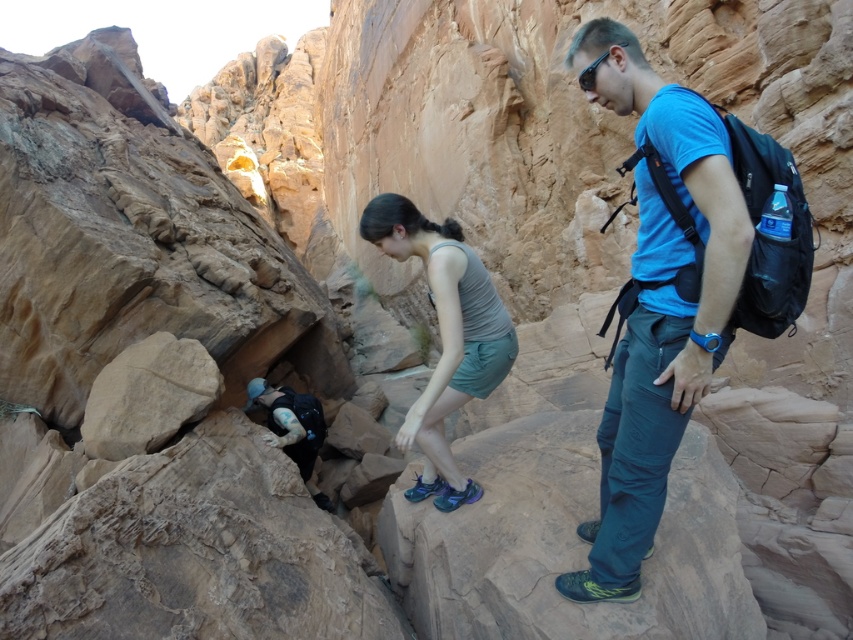
Which is more to the left, blue fabric shirt at upper right or gray fabric tank top at center?

Positioned to the left is gray fabric tank top at center.

The height and width of the screenshot is (640, 853). Describe the element at coordinates (657, 305) in the screenshot. I see `blue fabric shirt at upper right` at that location.

Is point (596, 588) positioned behind point (445, 296)?

No, (596, 588) is closer to viewer.

You are a GUI agent. You are given a task and a screenshot of the screen. Output one action in this format:
    pyautogui.click(x=<x>, y=<y>)
    Task: Click on the blue fabric shirt at upper right
    
    Given the screenshot: What is the action you would take?
    pyautogui.click(x=657, y=305)

Is point (630, 65) behind point (677, 177)?

Yes, it is behind point (677, 177).

I want to click on blue fabric shirt at upper right, so click(657, 305).

Who is more distant from viewer, (608, 467) or (654, 440)?

The point (608, 467) is more distant.

Find the location of a particular element. This screenshot has width=853, height=640. blue fabric shirt at upper right is located at coordinates (657, 305).

Based on the photo, which is below, gray fabric tank top at center or black plastic sunglasses at upper right?

Positioned lower is gray fabric tank top at center.

Does gray fabric tank top at center appear under black plastic sunglasses at upper right?

Yes.

I want to click on gray fabric tank top at center, so click(x=445, y=337).